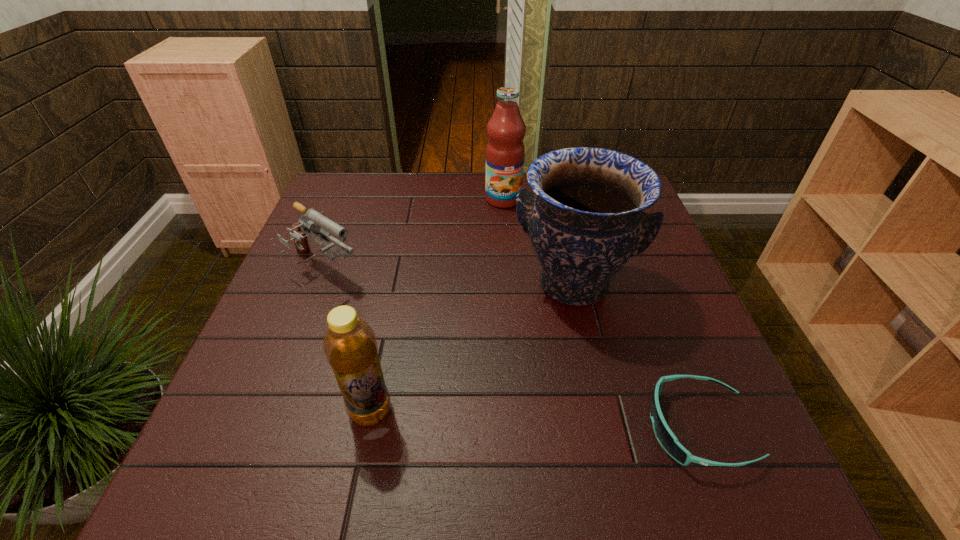
Where is `unoccupied position between the farthest object and the shortest object`? The width and height of the screenshot is (960, 540). unoccupied position between the farthest object and the shortest object is located at coordinates (601, 314).

Where is `vacant space that is in between the shortest object and the gun`? The width and height of the screenshot is (960, 540). vacant space that is in between the shortest object and the gun is located at coordinates (512, 349).

Find the location of a particular element. free space between the shortest object and the pottery is located at coordinates (636, 356).

At what (x,y) coordinates should I click in order to perform the action: click on vacant area between the pottery and the bottle. Please return your answer as a coordinate pair (x, y). The image size is (960, 540). Looking at the image, I should click on (472, 347).

Locate an element on the screen. free spot between the sunglasses and the fourth tallest object is located at coordinates (512, 349).

This screenshot has height=540, width=960. In order to click on free area in between the pottery and the fourth object from right to left in this screenshot , I will do `click(472, 347)`.

Locate an element on the screen. Image resolution: width=960 pixels, height=540 pixels. empty space between the bottle and the sunglasses is located at coordinates (535, 419).

Point out which object is positioned as the fourth nearest to the fruit juice. Please provide its 2D coordinates. Your answer should be formatted as a tuple, i.e. [(x, y)], where the tuple contains the x and y coordinates of a point satisfying the conditions above.

[(350, 346)]

You are a GUI agent. You are given a task and a screenshot of the screen. Output one action in this format:
    pyautogui.click(x=<x>, y=<y>)
    Task: Click on the object that is the fourth closest to the pottery
    This screenshot has width=960, height=540.
    Given the screenshot: What is the action you would take?
    pyautogui.click(x=316, y=223)

Locate an element on the screen. vacant space that satisfies the following two spatial constraints: 1. on the front side of the pottery; 2. on the front-facing side of the sunglasses is located at coordinates (606, 428).